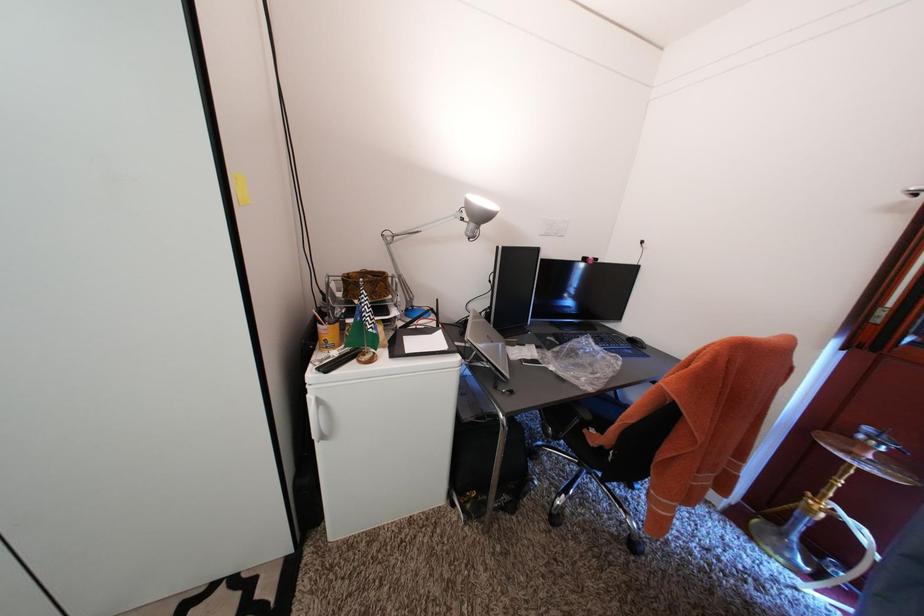
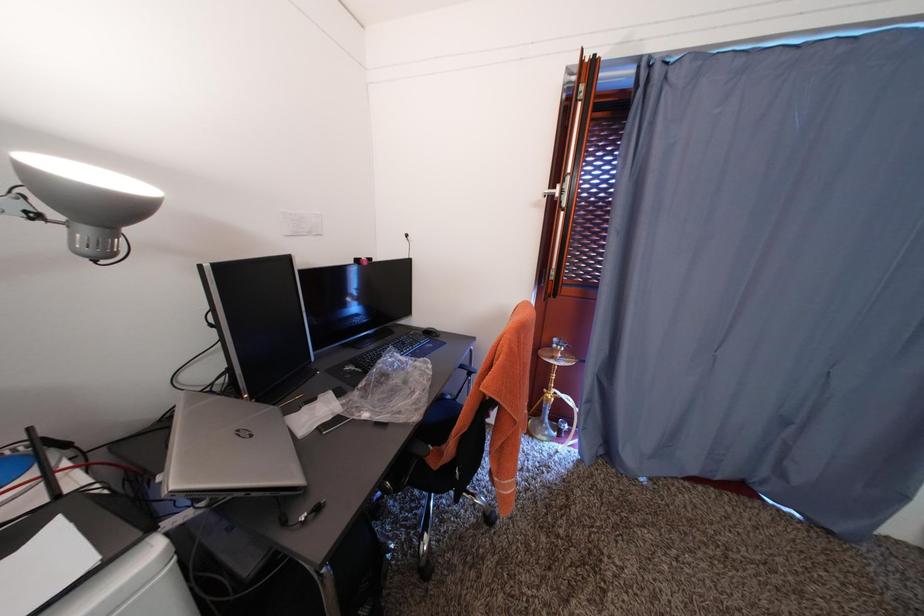
Question: How did the camera likely rotate?

Choices:
 (A) Left
 (B) Right
 (C) Up
 (D) Down

Answer: (B)